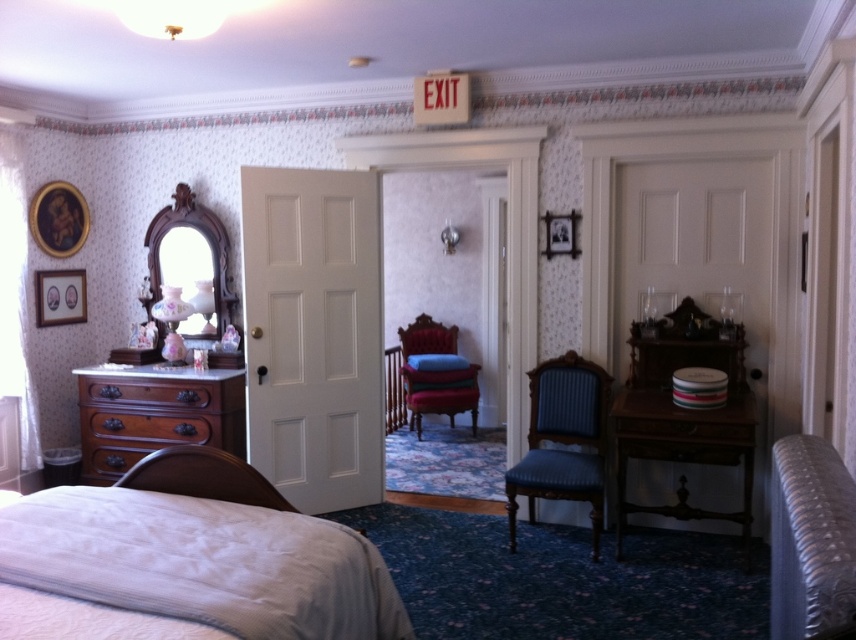
You are standing in the vintage bedroom and want to place a small plant between the two points marked as point (342,534) and point (420,314). Based on their positions, which point should the plant be closer to to ensure it is in front?

The plant should be closer to point (342,534) because it is in front of point (420,314) according to their positions.

You are moving a small plant pot that is 0.5 meters wide. You want to place it on the surface between the mahogany wooden dresser at left and the blue fabric chair at center. Is there enough space for the plant pot?

The mahogany wooden dresser at left is larger in size than the blue fabric chair at center, so there is sufficient space between them to place the 0.5 meters wide plant pot.

You are sitting in the vintage bedroom and need to choose between the blue fabric chair at center and the velvet red chair at center. Which chair would you choose if you want the smaller one?

The blue fabric chair at center is smaller in size compared to the velvet red chair at center, so you should choose the blue fabric chair at center.